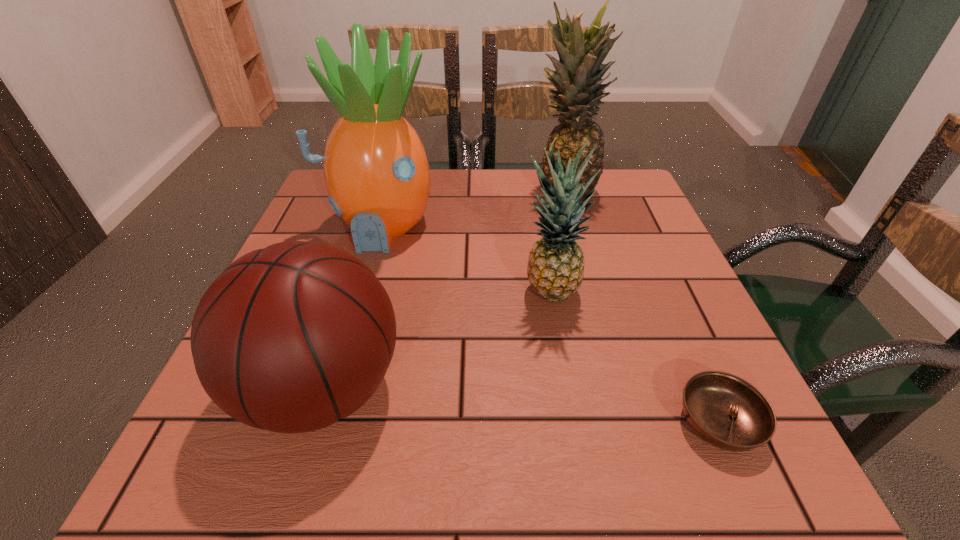
The width and height of the screenshot is (960, 540). Find the location of `soup bowl positioned at the near edge`. soup bowl positioned at the near edge is located at coordinates click(x=726, y=411).

Find the location of a particular element. The height and width of the screenshot is (540, 960). pineapple that is at the left edge is located at coordinates (376, 171).

The image size is (960, 540). What are the coordinates of `basketball that is at the left edge` in the screenshot? It's located at (291, 338).

Image resolution: width=960 pixels, height=540 pixels. I want to click on pineapple located at the right edge, so click(578, 76).

Identify the location of soup bowl that is at the right edge. (726, 411).

Identify the location of object present at the far left corner. (376, 171).

Locate an element on the screen. The height and width of the screenshot is (540, 960). object at the near left corner is located at coordinates (291, 338).

Where is `object present at the far right corner`? This screenshot has height=540, width=960. object present at the far right corner is located at coordinates (578, 76).

This screenshot has width=960, height=540. In order to click on object located in the near right corner section of the desktop in this screenshot , I will do `click(726, 411)`.

What are the coordinates of `free space at the far edge` in the screenshot? It's located at (438, 218).